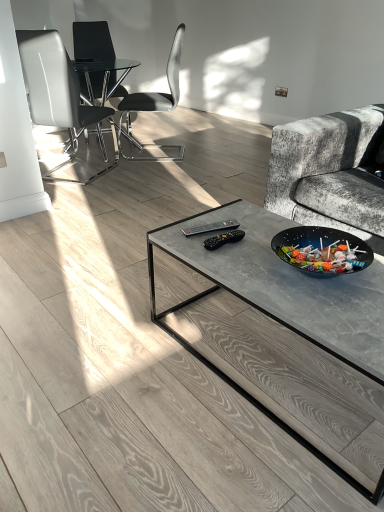
Where is `vacant area that lies in front of white leather chair at left, acting as the first chair starting from the front`? vacant area that lies in front of white leather chair at left, acting as the first chair starting from the front is located at coordinates (85, 188).